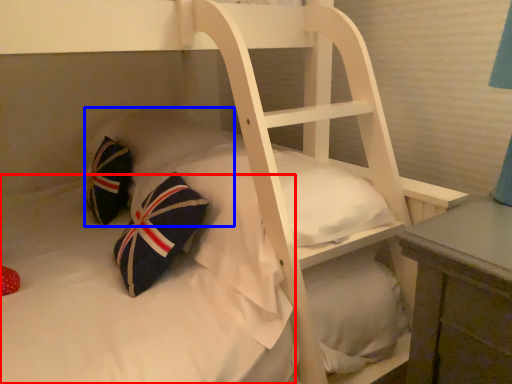
Question: Which object is further to the camera taking this photo, mattress (highlighted by a red box) or pillow (highlighted by a blue box)?

Choices:
 (A) mattress
 (B) pillow

Answer: (B)